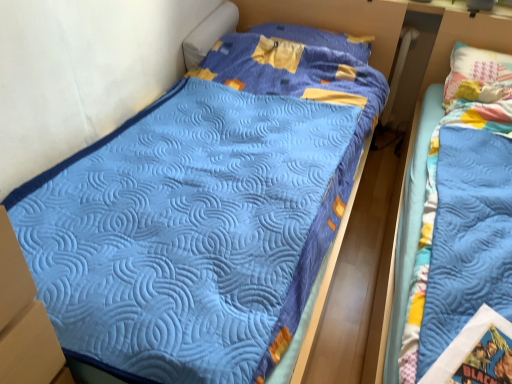
What do you see at coordinates (318, 38) in the screenshot? I see `blue quilted pillow at upper center` at bounding box center [318, 38].

At what (x,y) coordinates should I click in order to perform the action: click on blue quilted pillow at upper center. Please return your answer as a coordinate pair (x, y). The image size is (512, 384). Looking at the image, I should click on (318, 38).

Where is `blue quilted bed at right`? blue quilted bed at right is located at coordinates (415, 139).

Describe the element at coordinates (415, 139) in the screenshot. I see `blue quilted bed at right` at that location.

The image size is (512, 384). I want to click on blue quilted pillow at upper center, so click(318, 38).

In the image, is blue quilted bed at right on the left side or the right side of blue quilted pillow at upper center?

In the image, blue quilted bed at right appears on the right side of blue quilted pillow at upper center.

Is blue quilted bed at right in front of or behind blue quilted pillow at upper center in the image?

In the image, blue quilted bed at right appears in front of blue quilted pillow at upper center.

Which is in front, point (394, 283) or point (264, 33)?

The point (394, 283) is in front.

From the image's perspective, would you say blue quilted bed at right is shown under blue quilted pillow at upper center?

Correct, blue quilted bed at right appears lower than blue quilted pillow at upper center in the image.

Based on the photo, from a real-world perspective, relative to blue quilted pillow at upper center, is blue quilted bed at right vertically above or below?

From a real-world perspective, blue quilted bed at right is physically below blue quilted pillow at upper center.

Is blue quilted bed at right thinner than blue quilted pillow at upper center?

No, blue quilted bed at right is not thinner than blue quilted pillow at upper center.

Is blue quilted bed at right taller or shorter than blue quilted pillow at upper center?

blue quilted bed at right is taller than blue quilted pillow at upper center.

In terms of size, does blue quilted bed at right appear bigger or smaller than blue quilted pillow at upper center?

In the image, blue quilted bed at right appears to be larger than blue quilted pillow at upper center.

Would you say blue quilted bed at right is outside blue quilted pillow at upper center?

blue quilted bed at right lies outside blue quilted pillow at upper center's area.

Is blue quilted bed at right touching blue quilted pillow at upper center?

No, blue quilted bed at right is not making contact with blue quilted pillow at upper center.

Does blue quilted bed at right turn towards blue quilted pillow at upper center?

No, blue quilted bed at right is not oriented towards blue quilted pillow at upper center.

How many degrees apart are the facing directions of blue quilted bed at right and blue quilted pillow at upper center?

The angular difference between blue quilted bed at right and blue quilted pillow at upper center is 0.00859 degrees.

I want to click on pillow behind the blue quilted bed at right, so click(318, 38).

Does blue quilted pillow at upper center appear on the left side of blue quilted bed at right?

Yes.

Is blue quilted pillow at upper center in front of or behind blue quilted bed at right in the image?

In the image, blue quilted pillow at upper center appears behind blue quilted bed at right.

Considering the points (307, 44) and (471, 36), which point is in front, point (307, 44) or point (471, 36)?

Positioned in front is point (471, 36).

From the image's perspective, would you say blue quilted pillow at upper center is shown under blue quilted bed at right?

Actually, blue quilted pillow at upper center appears above blue quilted bed at right in the image.

From a real-world perspective, is blue quilted pillow at upper center positioned above or below blue quilted bed at right?

blue quilted pillow at upper center is above blue quilted bed at right.

Considering the sizes of objects blue quilted pillow at upper center and blue quilted bed at right in the image provided, who is wider, blue quilted pillow at upper center or blue quilted bed at right?

blue quilted bed at right.

From their relative heights in the image, would you say blue quilted pillow at upper center is taller or shorter than blue quilted bed at right?

Clearly, blue quilted pillow at upper center is shorter compared to blue quilted bed at right.

Who is smaller, blue quilted pillow at upper center or blue quilted bed at right?

blue quilted pillow at upper center.

Looking at this image, which is correct: blue quilted pillow at upper center is inside blue quilted bed at right, or outside of it?

blue quilted pillow at upper center lies outside blue quilted bed at right.

Can you see blue quilted pillow at upper center touching blue quilted bed at right?

blue quilted pillow at upper center and blue quilted bed at right are clearly separated.

Is blue quilted pillow at upper center facing towards blue quilted bed at right?

No, blue quilted pillow at upper center is not turned towards blue quilted bed at right.

At what (x,y) coordinates should I click in order to perform the action: click on bed below the blue quilted pillow at upper center (from a real-world perspective). Please return your answer as a coordinate pair (x, y). The image size is (512, 384). Looking at the image, I should click on (415, 139).

Locate an element on the screen. The image size is (512, 384). pillow above the blue quilted bed at right (from a real-world perspective) is located at coordinates (318, 38).

In order to click on pillow that appears on the left of blue quilted bed at right in this screenshot , I will do `click(318, 38)`.